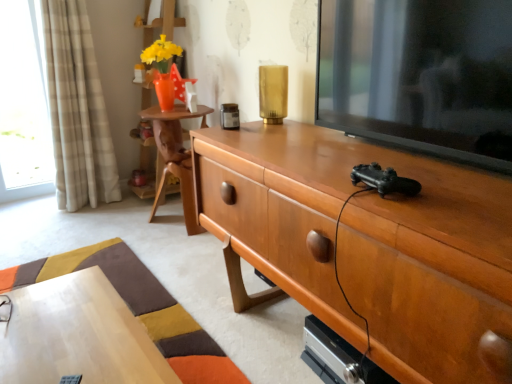
At what (x,y) coordinates should I click in order to perform the action: click on vacant space underneath black glossy television at right (from a real-world perspective). Please return your answer as a coordinate pair (x, y). This screenshot has height=384, width=512. Looking at the image, I should click on (402, 145).